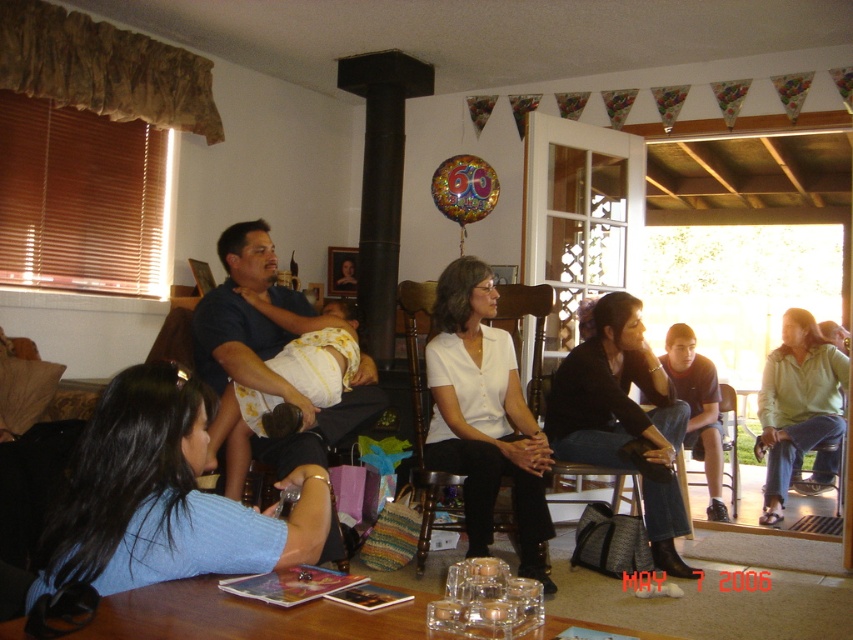
Can you confirm if white smooth shirt at center is thinner than matte white shirt at center?

Yes.

Does white smooth shirt at center lie behind matte white shirt at center?

Yes, it is.

Which is behind, point (525, 456) or point (701, 275)?

Positioned behind is point (701, 275).

This screenshot has height=640, width=853. What are the coordinates of `white smooth shirt at center` in the screenshot? It's located at (485, 417).

The width and height of the screenshot is (853, 640). Describe the element at coordinates (740, 260) in the screenshot. I see `matte white shirt at center` at that location.

Based on the photo, between matte white shirt at center and green cotton shirt at lower right, which one appears on the left side from the viewer's perspective?

Positioned to the left is matte white shirt at center.

Is point (822, 282) closer to viewer compared to point (843, 428)?

No.

Image resolution: width=853 pixels, height=640 pixels. What are the coordinates of `matte white shirt at center` in the screenshot? It's located at (740, 260).

Who is shorter, blue knit shirt at lower left or black leather jacket at center?

Standing shorter between the two is blue knit shirt at lower left.

How distant is blue knit shirt at lower left from black leather jacket at center?

6.62 feet

Locate an element on the screen. The height and width of the screenshot is (640, 853). blue knit shirt at lower left is located at coordinates (165, 497).